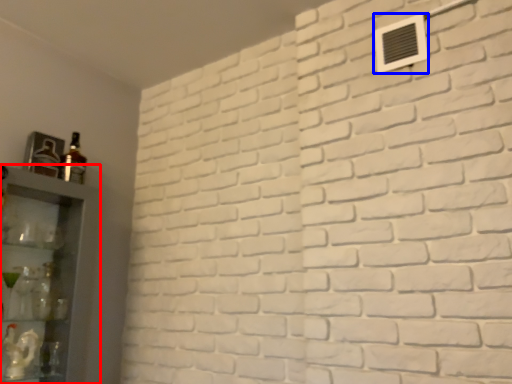
Question: Which object appears closest to the camera in this image, shelf (highlighted by a red box) or air conditioning (highlighted by a blue box)?

Choices:
 (A) shelf
 (B) air conditioning

Answer: (A)